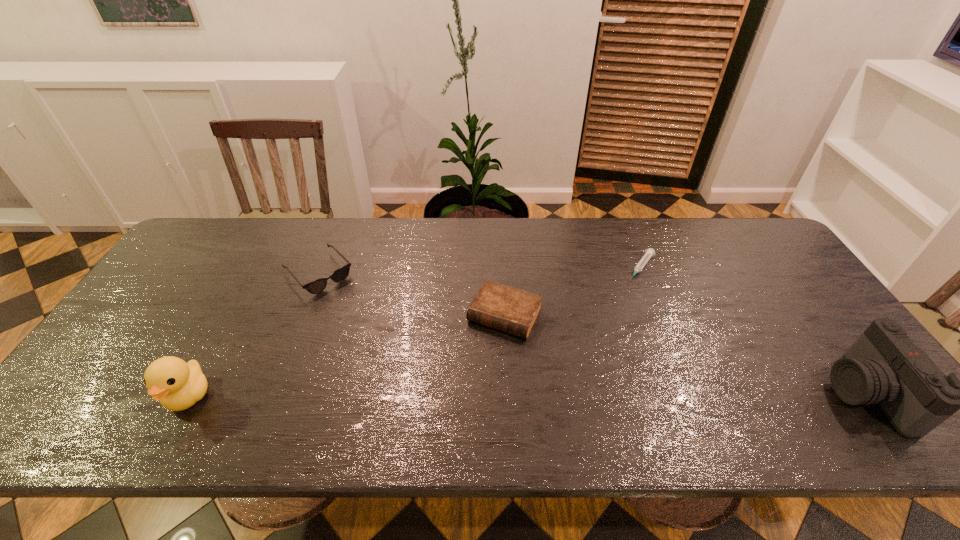
Identify the location of object that is the third nearest to the syringe. (316, 286).

This screenshot has width=960, height=540. I want to click on free region that satisfies the following two spatial constraints: 1. on the front side of the sunglasses; 2. at the lens of the rightmost object, so click(x=272, y=394).

Locate an element on the screen. The height and width of the screenshot is (540, 960). free spot that satisfies the following two spatial constraints: 1. on the front side of the syringe; 2. at the lens of the rightmost object is located at coordinates (691, 394).

Identify the location of free point that satisfies the following two spatial constraints: 1. on the front side of the second object from left to right; 2. at the lens of the rightmost object. (272, 394).